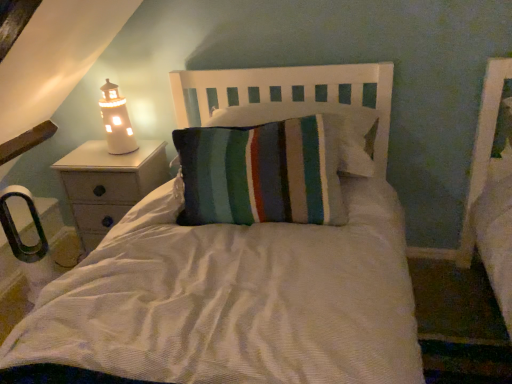
What do you see at coordinates (108, 184) in the screenshot?
I see `white wood nightstand at left` at bounding box center [108, 184].

Find the location of a particular element. The image size is (512, 384). white ceramic lighthouse at left is located at coordinates (116, 121).

Identify the location of white wood nightstand at left. (108, 184).

Does white ceramic lighthouse at left lie behind white wood nightstand at left?

No, it is not.

Can you confirm if white ceramic lighthouse at left is taller than white wood nightstand at left?

No.

From a real-world perspective, is white ceramic lighthouse at left on top of white wood nightstand at left?

Correct, in the physical world, white ceramic lighthouse at left is higher than white wood nightstand at left.

From the image's perspective, relative to white wood headboard at center, is white wood nightstand at left above or below?

Clearly, from the image's perspective, white wood nightstand at left is below white wood headboard at center.

What's the angular difference between white wood nightstand at left and white wood headboard at center's facing directions?

The angular difference between white wood nightstand at left and white wood headboard at center is 92 degrees.

Is point (144, 182) positioned behind point (225, 96)?

Yes, point (144, 182) is behind point (225, 96).

Is white wood nightstand at left situated inside white wood headboard at center or outside?

white wood nightstand at left is located beyond the bounds of white wood headboard at center.

Is white wood headboard at center facing away from white ceramic lighthouse at left?

No, white wood headboard at center's orientation is not away from white ceramic lighthouse at left.

Is white wood headboard at center not within white ceramic lighthouse at left?

Yes, white wood headboard at center is located beyond the bounds of white ceramic lighthouse at left.

Is white wood headboard at center taller than white ceramic lighthouse at left?

No, white wood headboard at center is not taller than white ceramic lighthouse at left.

In the image, is white wood headboard at center positioned in front of or behind white wood nightstand at left?

In the image, white wood headboard at center appears in front of white wood nightstand at left.

Is white wood headboard at center to the left or to the right of white wood nightstand at left in the image?

In the image, white wood headboard at center appears on the right side of white wood nightstand at left.

Considering the relative sizes of white wood headboard at center and white wood nightstand at left in the image provided, is white wood headboard at center shorter than white wood nightstand at left?

Indeed, white wood headboard at center has a lesser height compared to white wood nightstand at left.

From a real-world perspective, is white wood nightstand at left positioned over white ceramic lighthouse at left based on gravity?

No, from a real-world perspective, white wood nightstand at left is not on top of white ceramic lighthouse at left.

Considering the relative positions of white wood nightstand at left and white ceramic lighthouse at left in the image provided, is white wood nightstand at left to the left of white ceramic lighthouse at left from the viewer's perspective?

Yes, white wood nightstand at left is to the left of white ceramic lighthouse at left.

Is white wood nightstand at left turned away from white ceramic lighthouse at left?

No, white wood nightstand at left's orientation is not away from white ceramic lighthouse at left.

From the image's perspective, which one is positioned higher, white wood nightstand at left or white ceramic lighthouse at left?

white ceramic lighthouse at left appears higher in the image.

Is white ceramic lighthouse at left oriented away from white wood headboard at center?

No, white ceramic lighthouse at left is not facing away from white wood headboard at center.

Is the position of white ceramic lighthouse at left more distant than that of white wood headboard at center?

Yes.

Can you tell me how much white ceramic lighthouse at left and white wood headboard at center differ in facing direction?

The angular difference between white ceramic lighthouse at left and white wood headboard at center is 91.1 degrees.

Which object is positioned more to the left, white ceramic lighthouse at left or white wood headboard at center?

white ceramic lighthouse at left.

Find the location of a particular element. This screenshot has height=384, width=512. lamp that is on the right side of white wood nightstand at left is located at coordinates (116, 121).

Identify the location of nightstand located on the left of white wood headboard at center. (108, 184).

Looking at the image, which one is located further to white wood nightstand at left, white wood headboard at center or white ceramic lighthouse at left?

Among the two, white wood headboard at center is located further to white wood nightstand at left.

Which object lies nearer to the anchor point white ceramic lighthouse at left, white wood headboard at center or white wood nightstand at left?

white wood nightstand at left is closer to white ceramic lighthouse at left.

Looking at the image, which one is located further to white wood headboard at center, white ceramic lighthouse at left or white wood nightstand at left?

white ceramic lighthouse at left is positioned further to the anchor white wood headboard at center.

Based on their spatial positions, is white wood nightstand at left or white wood headboard at center further from white ceramic lighthouse at left?

white wood headboard at center lies further to white ceramic lighthouse at left than the other object.

Looking at this image, looking at the image, which one is located further to white wood nightstand at left, white ceramic lighthouse at left or white wood headboard at center?

Among the two, white wood headboard at center is located further to white wood nightstand at left.

Which object lies nearer to the anchor point white wood headboard at center, white wood nightstand at left or white ceramic lighthouse at left?

Based on the image, white wood nightstand at left appears to be nearer to white wood headboard at center.

Where is `lamp between white wood nightstand at left and white wood headboard at center in the horizontal direction`? Image resolution: width=512 pixels, height=384 pixels. lamp between white wood nightstand at left and white wood headboard at center in the horizontal direction is located at coordinates (116, 121).